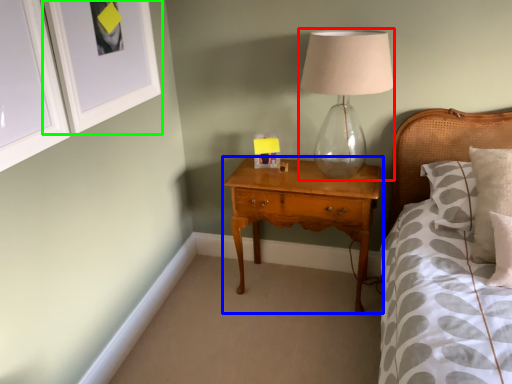
Question: Which object is the closest to the table lamp (highlighted by a red box)? Choose among these: nightstand (highlighted by a blue box) or picture frame (highlighted by a green box).

Choices:
 (A) nightstand
 (B) picture frame

Answer: (A)